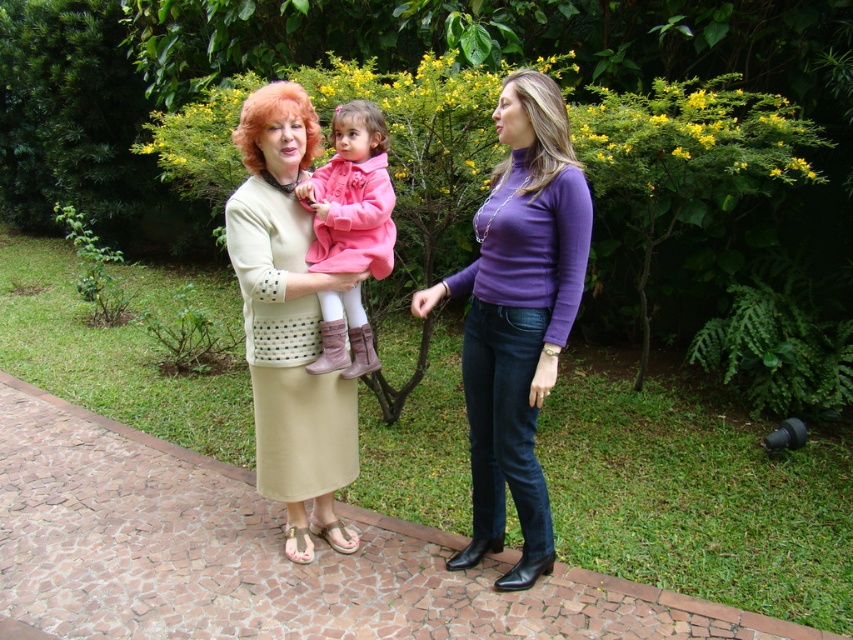
Question: Can you confirm if smooth purple turtleneck at center is bigger than blonde synthetic wig at center?

Choices:
 (A) no
 (B) yes

Answer: (A)

Question: Which point appears farthest from the camera in this image?

Choices:
 (A) (303, 116)
 (B) (544, 330)
 (C) (389, 237)

Answer: (C)

Question: In this image, where is pink matte coat at center located relative to smooth purple turtleneck at center?

Choices:
 (A) above
 (B) below

Answer: (B)

Question: Estimate the real-world distances between objects in this image. Which object is farther from the purple turtleneck sweater at center?

Choices:
 (A) blonde synthetic wig at center
 (B) smooth purple turtleneck at center
 (C) pink matte coat at center

Answer: (A)

Question: Does purple turtleneck sweater at center lie behind pink matte coat at center?

Choices:
 (A) yes
 (B) no

Answer: (B)

Question: Which object is the farthest from the pink matte coat at center?

Choices:
 (A) smooth purple turtleneck at center
 (B) blonde synthetic wig at center

Answer: (A)